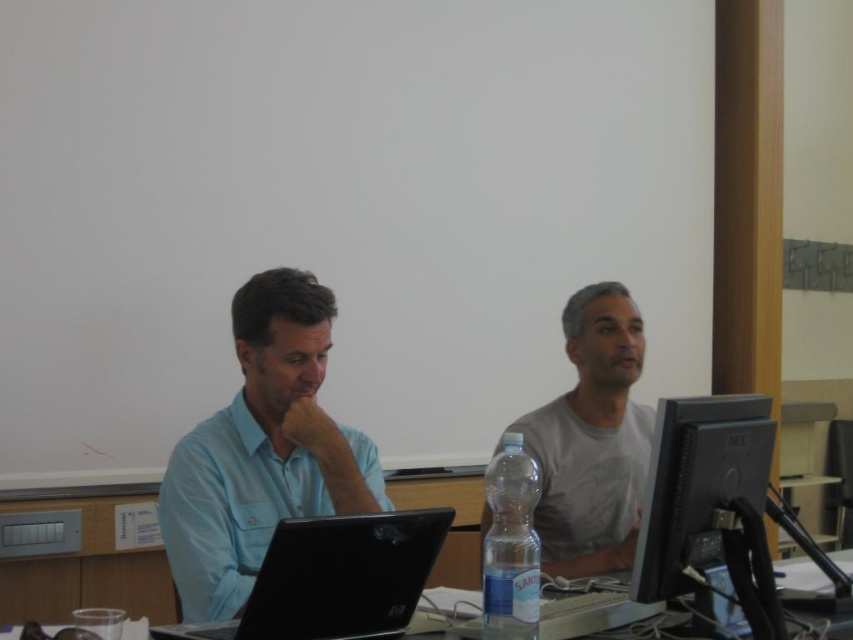
Question: Is clear plastic bottle at center in front of black plastic table at center?

Choices:
 (A) yes
 (B) no

Answer: (A)

Question: Estimate the real-world distances between objects in this image. Which object is farther from the black glossy monitor at right?

Choices:
 (A) matte black monitor at right
 (B) black glossy laptop at center

Answer: (B)

Question: Which object is farther from the camera taking this photo?

Choices:
 (A) gray cotton shirt at center
 (B) black glossy monitor at right

Answer: (A)

Question: Does matte black monitor at right lie in front of black glossy monitor at right?

Choices:
 (A) yes
 (B) no

Answer: (A)

Question: Considering the real-world distances, which object is closest to the gray cotton shirt at center?

Choices:
 (A) black glossy laptop at center
 (B) light blue shirt at center
 (C) clear plastic bottle at center
 (D) black plastic table at center

Answer: (B)

Question: Can you confirm if light blue shirt at center is positioned to the left of black plastic table at center?

Choices:
 (A) no
 (B) yes

Answer: (A)